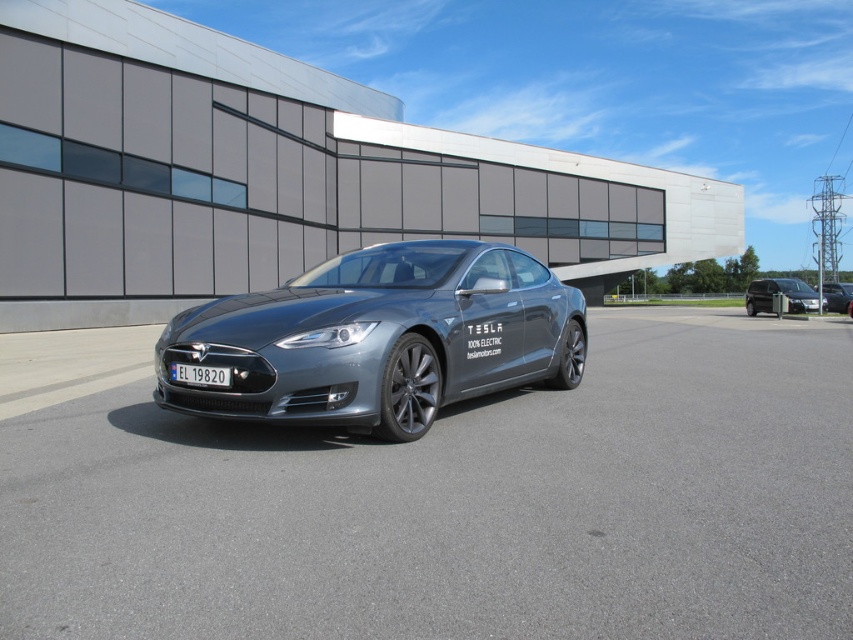
Does metallic silver van at right lie in front of red plastic license plate at center?

No, metallic silver van at right is behind red plastic license plate at center.

Image resolution: width=853 pixels, height=640 pixels. What do you see at coordinates (781, 292) in the screenshot?
I see `metallic silver van at right` at bounding box center [781, 292].

Image resolution: width=853 pixels, height=640 pixels. Describe the element at coordinates (781, 292) in the screenshot. I see `metallic silver van at right` at that location.

In order to click on metallic silver van at right in this screenshot , I will do `click(781, 292)`.

Can you confirm if sleek metallic car at center is wider than red plastic license plate at center?

Indeed, sleek metallic car at center has a greater width compared to red plastic license plate at center.

Is point (467, 355) closer to camera compared to point (224, 371)?

That is False.

Locate an element on the screen. sleek metallic car at center is located at coordinates (379, 339).

Can you confirm if sleek metallic car at center is positioned to the right of metallic silver sedan at center?

No, sleek metallic car at center is not to the right of metallic silver sedan at center.

Describe the element at coordinates (379, 339) in the screenshot. I see `sleek metallic car at center` at that location.

Is point (186, 342) less distant than point (822, 307)?

Yes, point (186, 342) is closer to viewer.

You are a GUI agent. You are given a task and a screenshot of the screen. Output one action in this format:
    pyautogui.click(x=<x>, y=<y>)
    Task: Click on the sleek metallic car at center
    This screenshot has height=640, width=853.
    Given the screenshot: What is the action you would take?
    pyautogui.click(x=379, y=339)